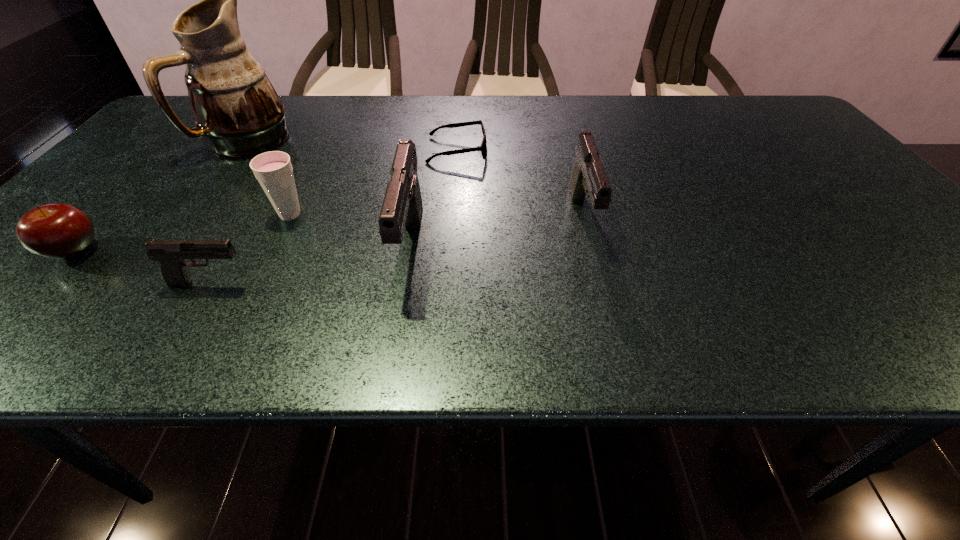
With all pistols evenly spaced, where should an extra pistol be placed on the right to continue the pattern? Please point out a vacant space. Please provide its 2D coordinates. Your answer should be formatted as a tuple, i.e. [(x, y)], where the tuple contains the x and y coordinates of a point satisfying the conditions above.

[(732, 192)]